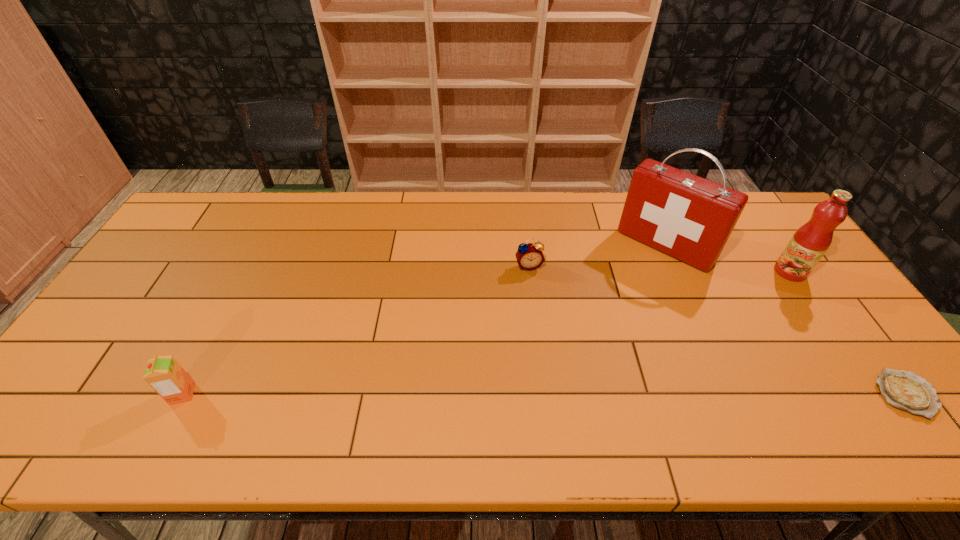
At what (x,y) coordinates should I click in order to perform the action: click on vacant spot on the desktop that is between the leftmost object and the quiche and is positioned on the front face of the first-aid kit. Please return your answer as a coordinate pair (x, y). Looking at the image, I should click on (540, 394).

Find the location of a particular element. Image resolution: width=960 pixels, height=540 pixels. vacant space on the desktop that is between the orange juice and the quiche and is positioned on the front label of the fruit juice is located at coordinates (647, 394).

Image resolution: width=960 pixels, height=540 pixels. What are the coordinates of `free space on the desktop that is between the third shortest object and the shortest object and is positioned on the front-facing side of the fourth object from right to left` in the screenshot? It's located at (568, 394).